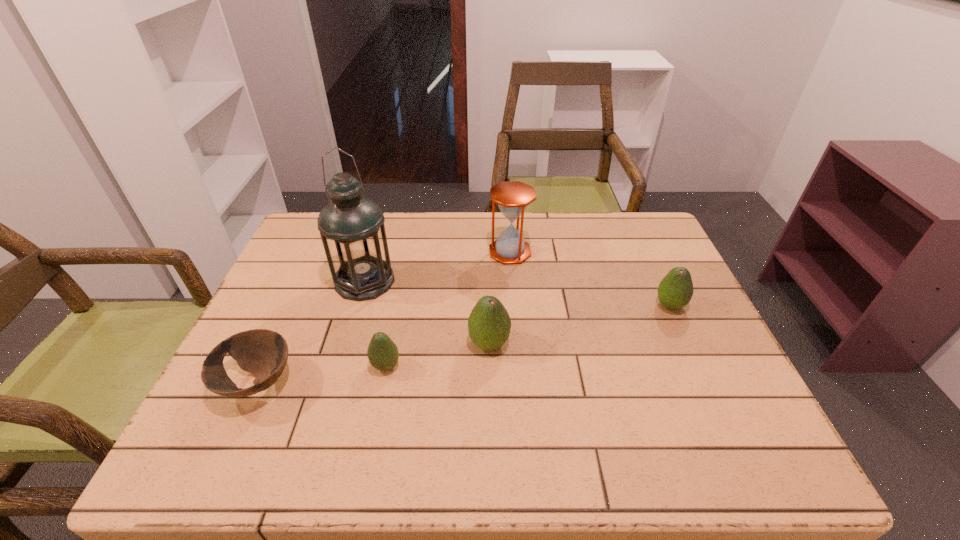
This screenshot has width=960, height=540. I want to click on vacant area between the leftmost object and the oil lamp, so click(311, 332).

You are a GUI agent. You are given a task and a screenshot of the screen. Output one action in this format:
    pyautogui.click(x=<x>, y=<y>)
    Task: Click on the empty space between the oil lamp and the bowl
    The image size is (960, 540).
    Given the screenshot: What is the action you would take?
    tap(311, 332)

Locate an element on the screen. This screenshot has width=960, height=540. free space between the hourglass and the fourth shortest object is located at coordinates coord(499,298).

The image size is (960, 540). What are the coordinates of `vacant point located between the leftmost avocado and the oil lamp` in the screenshot? It's located at (375, 323).

Locate an element on the screen. Image resolution: width=960 pixels, height=540 pixels. empty space between the leftmost avocado and the hourglass is located at coordinates (447, 309).

This screenshot has height=540, width=960. I want to click on the third closest object relative to the tallest avocado, so click(513, 197).

Locate an element on the screen. This screenshot has height=540, width=960. object that is the third closest one to the bowl is located at coordinates (489, 324).

The width and height of the screenshot is (960, 540). I want to click on the second closest avocado to the shortest avocado, so click(x=675, y=290).

Select which avocado appears as the second closest to the tallest avocado. Please provide its 2D coordinates. Your answer should be formatted as a tuple, i.e. [(x, y)], where the tuple contains the x and y coordinates of a point satisfying the conditions above.

[(675, 290)]

Where is `vacant space that satisfies the following two spatial constraints: 1. on the back side of the hourglass; 2. on the left side of the tallest avocado`? vacant space that satisfies the following two spatial constraints: 1. on the back side of the hourglass; 2. on the left side of the tallest avocado is located at coordinates (487, 252).